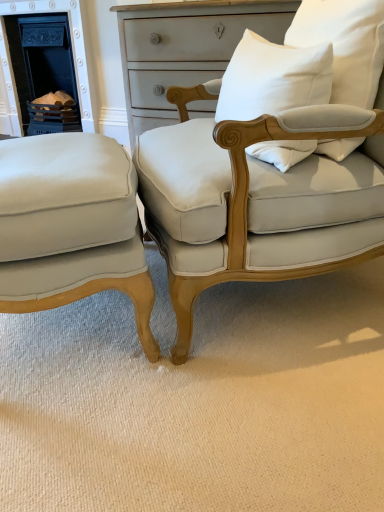
Question: Is white cotton pillow at upper right, marked as the 2th pillow in a right-to-left arrangement, in contact with matte cream fabric chair at lower left, the 2th chair when ordered from right to left?

Choices:
 (A) no
 (B) yes

Answer: (A)

Question: Does white cotton pillow at upper right, marked as the 2th pillow in a right-to-left arrangement, have a smaller size compared to matte cream fabric chair at lower left, the first chair when ordered from left to right?

Choices:
 (A) yes
 (B) no

Answer: (A)

Question: Can you confirm if white cotton pillow at upper right, marked as the 2th pillow in a right-to-left arrangement, is positioned to the left of matte cream fabric chair at lower left, the 2th chair when ordered from right to left?

Choices:
 (A) no
 (B) yes

Answer: (A)

Question: From the image's perspective, is white cotton pillow at upper right, placed as the first pillow when sorted from left to right, located beneath matte cream fabric chair at lower left, the first chair when ordered from left to right?

Choices:
 (A) yes
 (B) no

Answer: (B)

Question: Is white cotton pillow at upper right, placed as the first pillow when sorted from left to right, oriented away from matte cream fabric chair at lower left, the first chair when ordered from left to right?

Choices:
 (A) yes
 (B) no

Answer: (B)

Question: Is white cotton pillow at upper right, placed as the first pillow when sorted from left to right, completely or partially outside of matte cream fabric chair at lower left, the 2th chair when ordered from right to left?

Choices:
 (A) no
 (B) yes

Answer: (B)

Question: Does matte white fabric chair at center, the first chair from the right, have a lesser height compared to white cotton pillow at upper right, arranged as the second pillow when viewed from the left?

Choices:
 (A) yes
 (B) no

Answer: (B)

Question: From the image's perspective, is matte white fabric chair at center, the first chair from the right, over white cotton pillow at upper right, arranged as the second pillow when viewed from the left?

Choices:
 (A) no
 (B) yes

Answer: (A)

Question: Can you confirm if matte white fabric chair at center, the first chair from the right, is wider than white cotton pillow at upper right, arranged as the second pillow when viewed from the left?

Choices:
 (A) yes
 (B) no

Answer: (A)

Question: From the image's perspective, is matte white fabric chair at center, marked as the 2th chair in a left-to-right arrangement, located beneath white cotton pillow at upper right, which ranks as the first pillow in right-to-left order?

Choices:
 (A) no
 (B) yes

Answer: (B)

Question: Is matte white fabric chair at center, the first chair from the right, not inside white cotton pillow at upper right, arranged as the second pillow when viewed from the left?

Choices:
 (A) no
 (B) yes

Answer: (B)

Question: Is matte white fabric chair at center, the first chair from the right, bigger than white cotton pillow at upper right, which ranks as the first pillow in right-to-left order?

Choices:
 (A) no
 (B) yes

Answer: (B)

Question: From a real-world perspective, is matte white fabric chair at center, the first chair from the right, located higher than white cotton pillow at upper right, placed as the first pillow when sorted from left to right?

Choices:
 (A) yes
 (B) no

Answer: (B)